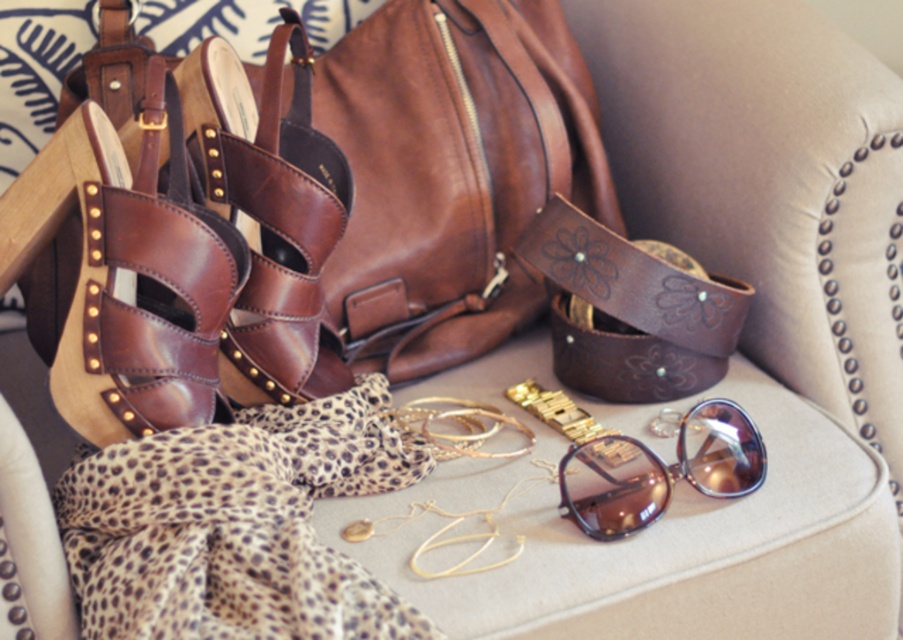
Question: Is brown leather bag at upper center positioned behind brown leather sandal at left?

Choices:
 (A) yes
 (B) no

Answer: (A)

Question: Among these objects, which one is nearest to the camera?

Choices:
 (A) shiny purple sunglasses at center
 (B) brown leather sandal at left
 (C) brown leather bag at upper center
 (D) shiny brown leather sandal at left

Answer: (D)

Question: From the image, what is the correct spatial relationship of shiny brown leather sandal at left in relation to brown leather sandal at left?

Choices:
 (A) right
 (B) left

Answer: (B)

Question: Which of the following is the closest to the observer?

Choices:
 (A) brown leather bag at upper center
 (B) shiny purple sunglasses at center
 (C) brown leather sandal at left

Answer: (B)

Question: Which of the following is the farthest from the observer?

Choices:
 (A) shiny purple sunglasses at center
 (B) brown leather bag at upper center
 (C) brown leather sandal at left

Answer: (B)

Question: Can you confirm if brown leather bag at upper center is thinner than shiny purple sunglasses at center?

Choices:
 (A) yes
 (B) no

Answer: (B)